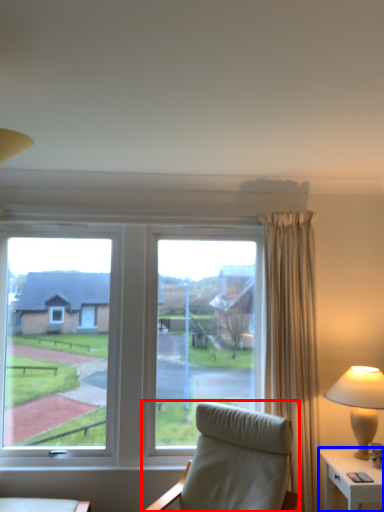
Question: Among these objects, which one is nearest to the camera, chair (highlighted by a red box) or nightstand (highlighted by a blue box)?

Choices:
 (A) chair
 (B) nightstand

Answer: (A)